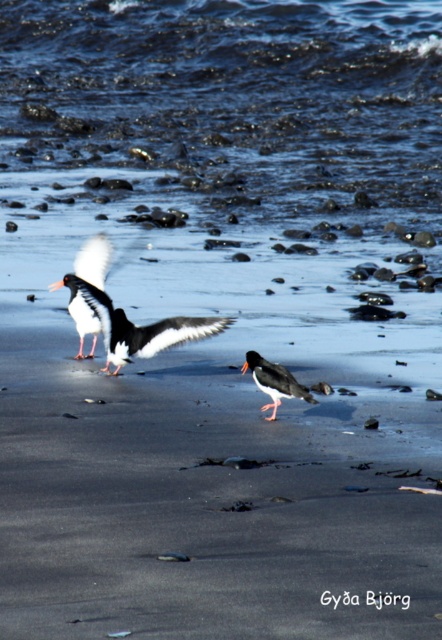
Question: Which point is farther from the camera taking this photo?

Choices:
 (A) (260, 410)
 (B) (130, 324)

Answer: (B)

Question: Can you confirm if white matte bird at center is wider than black glossy oystercatcher at center?

Choices:
 (A) no
 (B) yes

Answer: (B)

Question: Which of the following is the closest to the observer?

Choices:
 (A) (270, 392)
 (B) (101, 312)

Answer: (A)

Question: Does white matte bird at center have a larger size compared to black glossy oystercatcher at center?

Choices:
 (A) no
 (B) yes

Answer: (B)

Question: Which point is farther from the camera taking this photo?

Choices:
 (A) [91, 243]
 (B) [255, 374]

Answer: (A)

Question: Is white matte bird at center wider than black glossy oystercatcher at center?

Choices:
 (A) no
 (B) yes

Answer: (B)